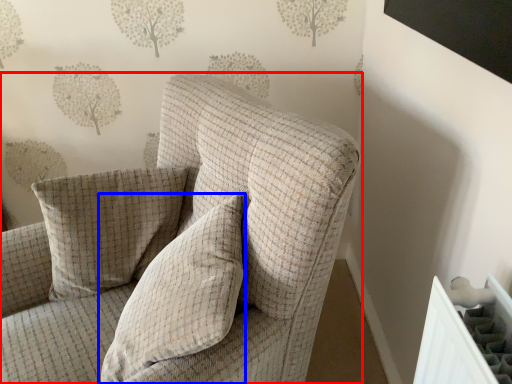
Question: Among these objects, which one is nearest to the camera, chair (highlighted by a red box) or pillow (highlighted by a blue box)?

Choices:
 (A) chair
 (B) pillow

Answer: (A)